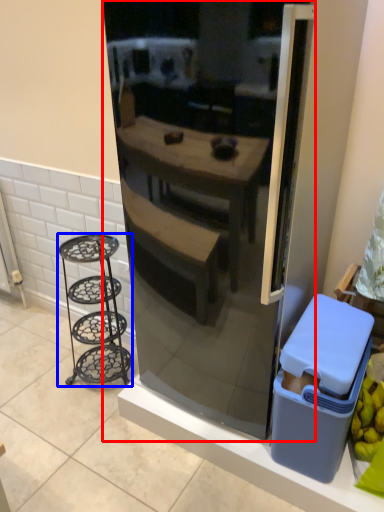
Question: Which object appears closest to the camera in this image, refrigerator (highlighted by a red box) or furniture (highlighted by a blue box)?

Choices:
 (A) refrigerator
 (B) furniture

Answer: (A)